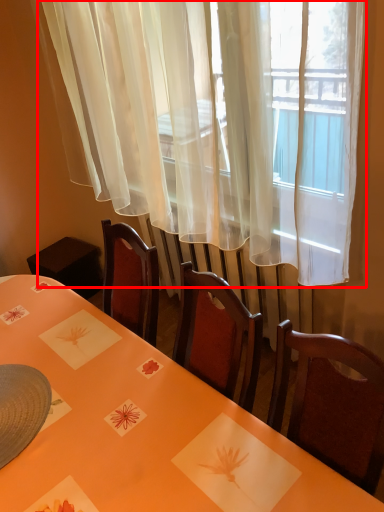
Question: Where is curtain (annotated by the red box) located in relation to table in the image?

Choices:
 (A) left
 (B) right

Answer: (B)